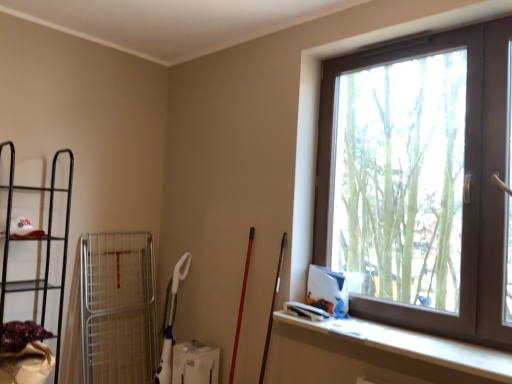
What do you see at coordinates (377, 356) in the screenshot? I see `white matte ledge at lower right` at bounding box center [377, 356].

Locate an element on the screen. This screenshot has width=512, height=384. black metal shelf at left is located at coordinates (39, 240).

Can you confirm if brown plastic window at upper right is thinner than white matte ledge at lower right?

Indeed, brown plastic window at upper right has a lesser width compared to white matte ledge at lower right.

Does brown plastic window at upper right come behind white matte ledge at lower right?

That is True.

Is brown plastic window at upper right positioned beyond the bounds of white matte ledge at lower right?

brown plastic window at upper right is positioned outside white matte ledge at lower right.

How different are the orientations of brown plastic window at upper right and white matte ledge at lower right in degrees?

They differ by 1.79e-05 degrees in their facing directions.

The width and height of the screenshot is (512, 384). I want to click on window that is above the black metal shelf at left (from a real-world perspective), so click(x=421, y=181).

Is black metal shelf at left positioned with its back to brown plastic window at upper right?

No, black metal shelf at left's orientation is not away from brown plastic window at upper right.

Measure the distance from black metal shelf at left to brown plastic window at upper right.

2.03 meters.

Based on the photo, is brown plastic window at upper right a part of black metal shelf at left?

Definitely not — brown plastic window at upper right is not inside black metal shelf at left.

Does white matte ledge at lower right have a greater width compared to brown plastic window at upper right?

Indeed, white matte ledge at lower right has a greater width compared to brown plastic window at upper right.

Which is closer, (x=323, y=342) or (x=348, y=56)?

Point (x=323, y=342) appears to be closer to the viewer than point (x=348, y=56).

In the image, is white matte ledge at lower right positioned in front of or behind brown plastic window at upper right?

Visually, white matte ledge at lower right is located in front of brown plastic window at upper right.

Based on the photo, choose the correct answer: Is black metal shelf at left inside white matte ledge at lower right or outside it?

black metal shelf at left lies outside white matte ledge at lower right.

Which is more to the left, black metal shelf at left or white matte ledge at lower right?

black metal shelf at left is more to the left.

Is black metal shelf at left bigger or smaller than white matte ledge at lower right?

In the image, black metal shelf at left appears to be larger than white matte ledge at lower right.

Considering the sizes of objects white matte ledge at lower right and black metal shelf at left in the image provided, who is shorter, white matte ledge at lower right or black metal shelf at left?

With less height is white matte ledge at lower right.

Is white matte ledge at lower right to the right of black metal shelf at left from the viewer's perspective?

Yes, white matte ledge at lower right is to the right of black metal shelf at left.

From the image's perspective, between white matte ledge at lower right and black metal shelf at left, who is located below?

white matte ledge at lower right.

From the image's perspective, is brown plastic window at upper right under black metal shelf at left?

Incorrect, from the image's perspective, brown plastic window at upper right is higher than black metal shelf at left.

Can you confirm if brown plastic window at upper right is bigger than black metal shelf at left?

Yes.

At what (x,y) coordinates should I click in order to perform the action: click on window in front of the black metal shelf at left. Please return your answer as a coordinate pair (x, y). This screenshot has height=384, width=512. Looking at the image, I should click on (421, 181).

From a real-world perspective, is brown plastic window at upper right on black metal shelf at left?

Indeed, from a real-world perspective, brown plastic window at upper right stands above black metal shelf at left.

I want to click on window located on the right of white matte ledge at lower right, so click(x=421, y=181).

I want to click on window in front of the black metal shelf at left, so click(x=421, y=181).

Estimate the real-world distances between objects in this image. Which object is further from black metal shelf at left, brown plastic window at upper right or white matte ledge at lower right?

brown plastic window at upper right.

From the image, which object appears to be nearer to black metal shelf at left, white matte ledge at lower right or brown plastic window at upper right?

Based on the image, white matte ledge at lower right appears to be nearer to black metal shelf at left.

Which object lies nearer to the anchor point brown plastic window at upper right, white matte ledge at lower right or black metal shelf at left?

white matte ledge at lower right.

Considering their positions, is brown plastic window at upper right positioned further to white matte ledge at lower right than black metal shelf at left?

The object further to white matte ledge at lower right is black metal shelf at left.

Based on their spatial positions, is black metal shelf at left or white matte ledge at lower right closer to brown plastic window at upper right?

The object closer to brown plastic window at upper right is white matte ledge at lower right.

Looking at the image, which one is located closer to white matte ledge at lower right, black metal shelf at left or brown plastic window at upper right?

brown plastic window at upper right is positioned closer to the anchor white matte ledge at lower right.

The width and height of the screenshot is (512, 384). I want to click on ledge between black metal shelf at left and brown plastic window at upper right in the horizontal direction, so click(377, 356).